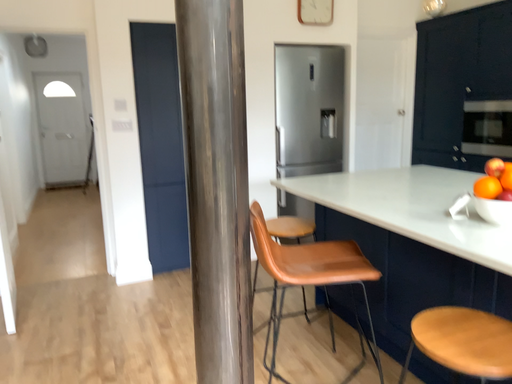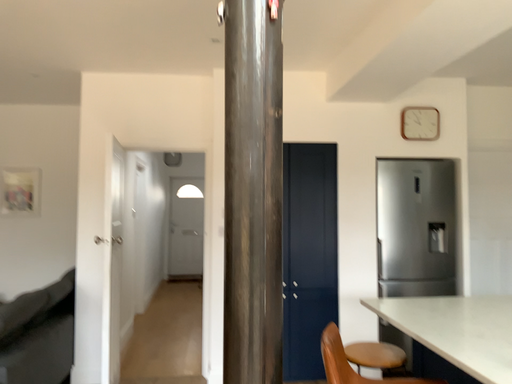
Question: How did the camera likely rotate when shooting the video?

Choices:
 (A) rotated downward
 (B) rotated upward

Answer: (B)